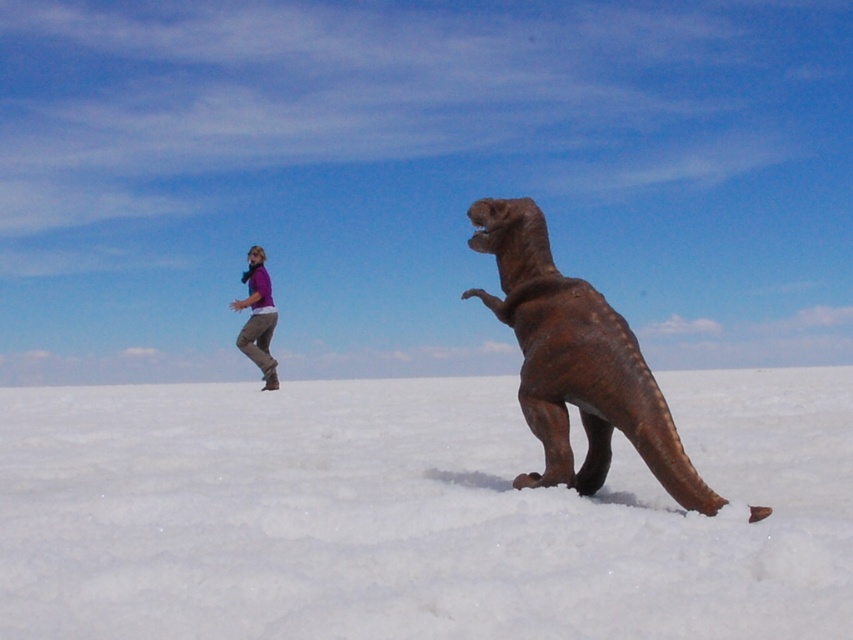
Can you confirm if white fluffy snow at center is positioned below purple fabric shirt at upper left?

Yes.

Is white fluffy snow at center smaller than purple fabric shirt at upper left?

Actually, white fluffy snow at center might be larger than purple fabric shirt at upper left.

Is point (85, 604) farther from viewer compared to point (268, 310)?

No, it is not.

You are a GUI agent. You are given a task and a screenshot of the screen. Output one action in this format:
    pyautogui.click(x=<x>, y=<y>)
    Task: Click on the white fluffy snow at center
    The width and height of the screenshot is (853, 640).
    Given the screenshot: What is the action you would take?
    pyautogui.click(x=415, y=515)

Is rusty metal dinosaur at center bigger than purple fabric shirt at upper left?

Indeed, rusty metal dinosaur at center has a larger size compared to purple fabric shirt at upper left.

Is rusty metal dinosaur at center positioned in front of purple fabric shirt at upper left?

Yes, it is in front of purple fabric shirt at upper left.

Who is more forward, (471, 241) or (262, 353)?

Point (471, 241) is in front.

The width and height of the screenshot is (853, 640). I want to click on rusty metal dinosaur at center, so click(576, 362).

Does white fluffy snow at center appear on the right side of rusty metal dinosaur at center?

In fact, white fluffy snow at center is to the left of rusty metal dinosaur at center.

Is white fluffy snow at center taller than rusty metal dinosaur at center?

No.

Who is more forward, [321,547] or [686,492]?

Point [321,547]

Image resolution: width=853 pixels, height=640 pixels. What are the coordinates of `white fluffy snow at center` in the screenshot? It's located at (415, 515).